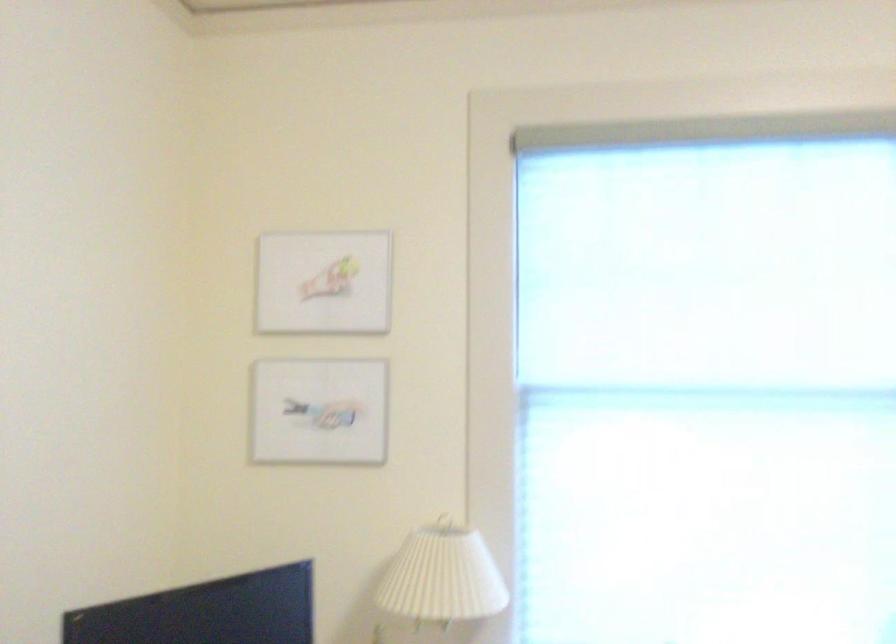
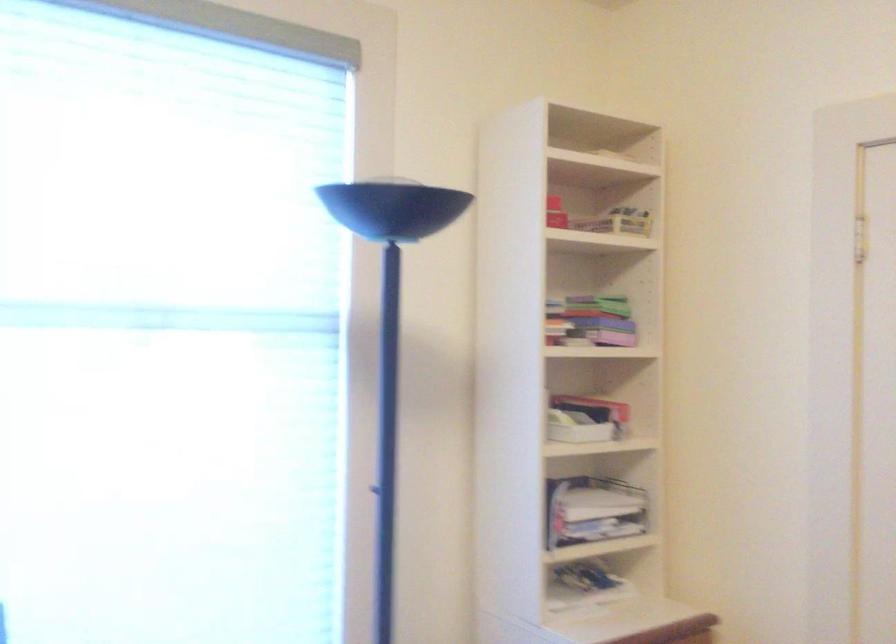
Question: Based on the continuous images, in which direction is the camera rotating? Reply with the corresponding letter.

Choices:
 (A) Left
 (B) Right
 (C) Up
 (D) Down

Answer: (B)